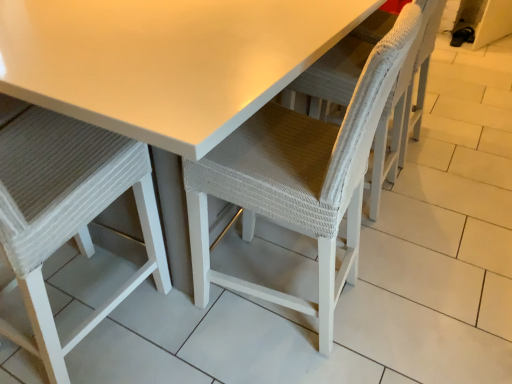
Question: Considering the positions of white woven chair at left, placed as the first chair when sorted from left to right, and white woven chair at center, the 2th chair viewed from the left, in the image, is white woven chair at left, placed as the first chair when sorted from left to right, taller or shorter than white woven chair at center, the 2th chair viewed from the left,?

Choices:
 (A) short
 (B) tall

Answer: (B)

Question: Is white woven chair at left, placed as the first chair when sorted from left to right, inside the boundaries of white woven chair at center, acting as the first chair starting from the right, or outside?

Choices:
 (A) inside
 (B) outside

Answer: (B)

Question: Based on their relative distances, which object is nearer to the white woven chair at left, which is counted as the 2th chair, starting from the right?

Choices:
 (A) white matte table at center
 (B) white woven chair at center, the 2th chair viewed from the left

Answer: (A)

Question: Based on their relative distances, which object is nearer to the white woven chair at left, placed as the first chair when sorted from left to right?

Choices:
 (A) white matte table at center
 (B) white woven chair at center, acting as the first chair starting from the right

Answer: (A)